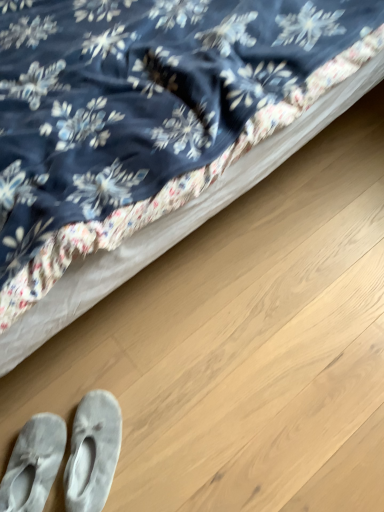
Question: Is velvety blue bed at upper left at the left side of gray suede slippers at lower left, acting as the first footwear starting from the left?

Choices:
 (A) yes
 (B) no

Answer: (B)

Question: Can gray suede slippers at lower left, acting as the first footwear starting from the left, be found inside velvety blue bed at upper left?

Choices:
 (A) no
 (B) yes

Answer: (A)

Question: Is velvety blue bed at upper left completely or partially outside of gray suede slippers at lower left, the 2th footwear viewed from the right?

Choices:
 (A) yes
 (B) no

Answer: (A)

Question: Can you confirm if velvety blue bed at upper left is smaller than gray suede slippers at lower left, acting as the first footwear starting from the left?

Choices:
 (A) yes
 (B) no

Answer: (B)

Question: Does velvety blue bed at upper left have a lesser height compared to gray suede slippers at lower left, acting as the first footwear starting from the left?

Choices:
 (A) no
 (B) yes

Answer: (A)

Question: From a real-world perspective, is gray suede slippers at lower left, the 2th footwear viewed from the right, positioned above or below light gray suede slippers at lower left, which is the 1th footwear in right-to-left order?

Choices:
 (A) above
 (B) below

Answer: (B)

Question: From the image's perspective, is gray suede slippers at lower left, acting as the first footwear starting from the left, above or below light gray suede slippers at lower left, which is the 1th footwear in right-to-left order?

Choices:
 (A) below
 (B) above

Answer: (A)

Question: From their relative heights in the image, would you say gray suede slippers at lower left, the 2th footwear viewed from the right, is taller or shorter than light gray suede slippers at lower left, which is the 1th footwear in right-to-left order?

Choices:
 (A) tall
 (B) short

Answer: (B)

Question: Considering their positions, is gray suede slippers at lower left, acting as the first footwear starting from the left, located in front of or behind light gray suede slippers at lower left, arranged as the second footwear when viewed from the left?

Choices:
 (A) behind
 (B) front

Answer: (B)

Question: Is point (6, 477) positioned closer to the camera than point (210, 182)?

Choices:
 (A) closer
 (B) farther

Answer: (B)

Question: Is gray suede slippers at lower left, the 2th footwear viewed from the right, wider or thinner than velvety blue bed at upper left?

Choices:
 (A) thin
 (B) wide

Answer: (A)

Question: In the image, is gray suede slippers at lower left, the 2th footwear viewed from the right, positioned in front of or behind velvety blue bed at upper left?

Choices:
 (A) front
 (B) behind

Answer: (B)

Question: Choose the correct answer: Is gray suede slippers at lower left, the 2th footwear viewed from the right, inside velvety blue bed at upper left or outside it?

Choices:
 (A) outside
 (B) inside

Answer: (A)

Question: Is velvety blue bed at upper left situated inside gray suede slippers at lower left, the 2th footwear viewed from the right, or outside?

Choices:
 (A) outside
 (B) inside

Answer: (A)

Question: Considering their positions, is velvety blue bed at upper left located in front of or behind gray suede slippers at lower left, the 2th footwear viewed from the right?

Choices:
 (A) behind
 (B) front

Answer: (B)